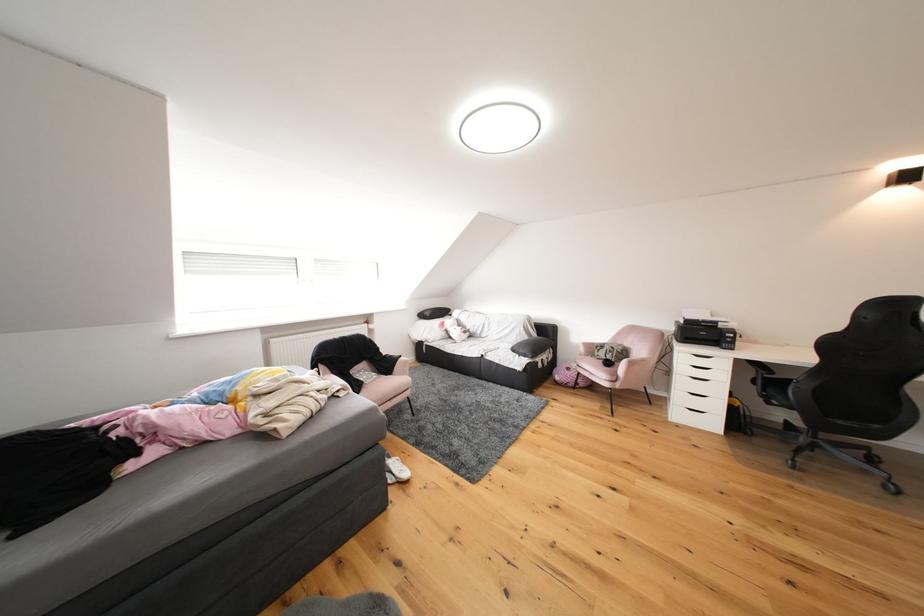
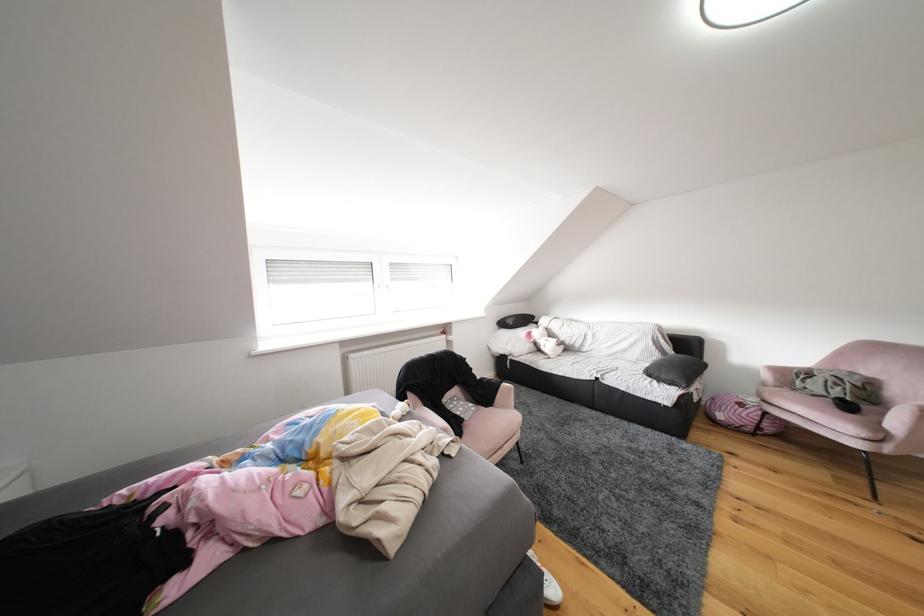
Question: The camera is either moving clockwise (left) or counter-clockwise (right) around the object. The first image is from the beginning of the video and the second image is from the end. Is the camera moving left or right when shooting the video?

Choices:
 (A) Left
 (B) Right

Answer: (B)